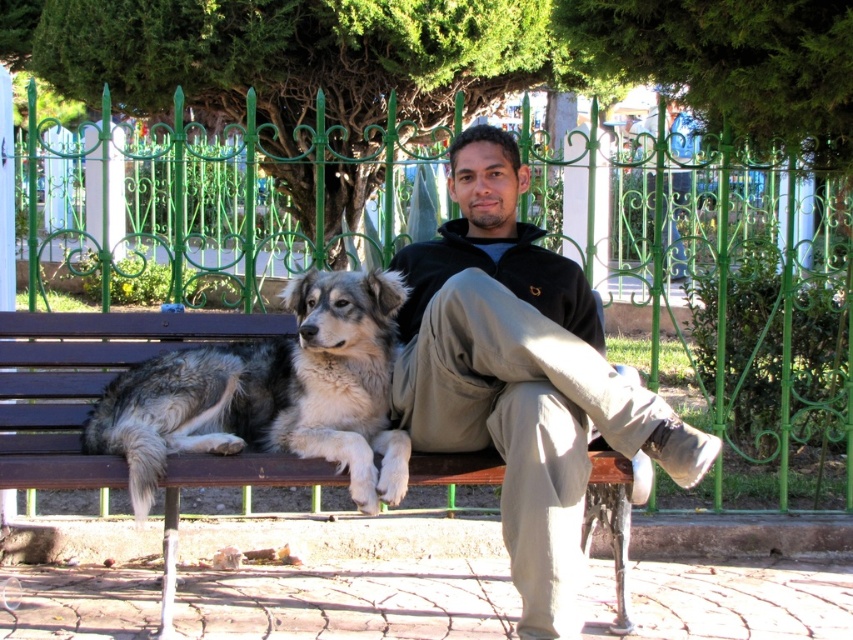
Between black fleece jacket at center and gray-furred dog at center, which one is positioned higher?

black fleece jacket at center is higher up.

Who is positioned more to the left, black fleece jacket at center or gray-furred dog at center?

From the viewer's perspective, gray-furred dog at center appears more on the left side.

Does point (537, 346) come farther from viewer compared to point (141, 380)?

That is False.

Where is `black fleece jacket at center`? The width and height of the screenshot is (853, 640). black fleece jacket at center is located at coordinates (521, 376).

Can you confirm if black fleece jacket at center is positioned to the right of brown wooden bench at center?

Yes, black fleece jacket at center is to the right of brown wooden bench at center.

Does black fleece jacket at center come behind brown wooden bench at center?

No, it is in front of brown wooden bench at center.

Which is in front, point (523, 444) or point (265, 472)?

Point (523, 444)

This screenshot has width=853, height=640. Identify the location of black fleece jacket at center. (521, 376).

Who is more forward, (360,403) or (1,324)?

Point (360,403) is more forward.

Can you confirm if gray-furred dog at center is wider than brown wooden bench at center?

Incorrect, gray-furred dog at center's width does not surpass brown wooden bench at center's.

What do you see at coordinates (271, 394) in the screenshot? I see `gray-furred dog at center` at bounding box center [271, 394].

I want to click on gray-furred dog at center, so click(x=271, y=394).